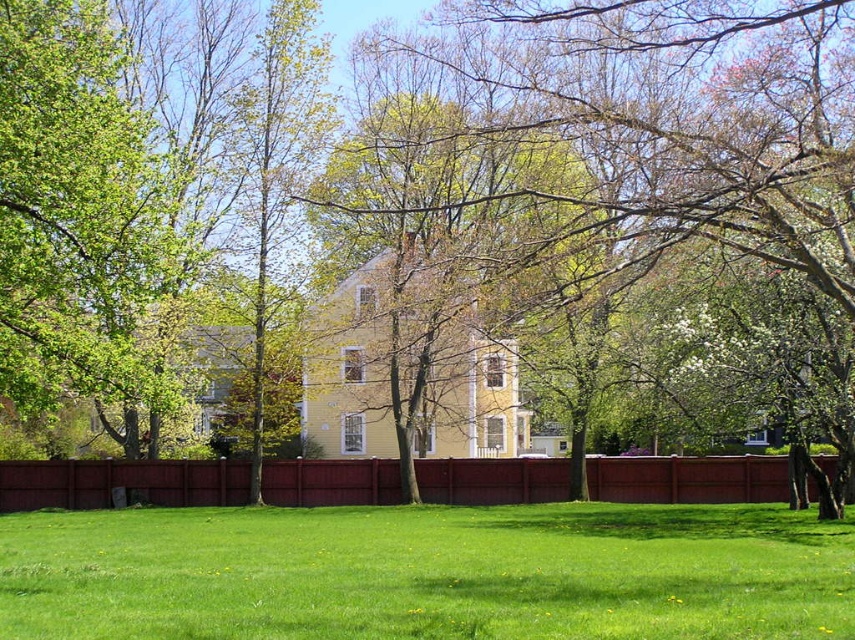
Question: Among these points, which one is farthest from the camera?

Choices:
 (A) (850, 520)
 (B) (108, 499)

Answer: (B)

Question: Is the position of green grass at center less distant than that of burgundy wood fence at center?

Choices:
 (A) yes
 (B) no

Answer: (A)

Question: Among these points, which one is nearest to the camera?

Choices:
 (A) pyautogui.click(x=357, y=472)
 (B) pyautogui.click(x=700, y=628)

Answer: (B)

Question: Does green grass at center appear on the right side of burgundy wood fence at center?

Choices:
 (A) no
 (B) yes

Answer: (B)

Question: Can you confirm if green grass at center is bigger than burgundy wood fence at center?

Choices:
 (A) yes
 (B) no

Answer: (A)